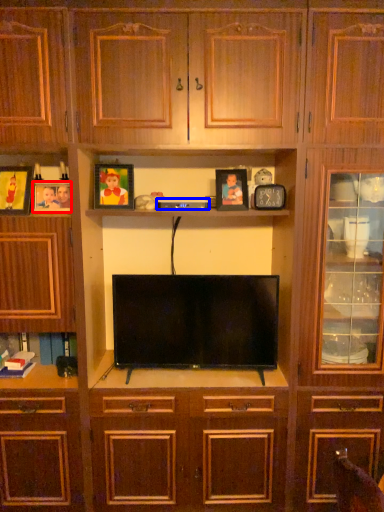
Question: Among these objects, which one is nearest to the camera, picture frame (highlighted by a red box) or appliance (highlighted by a blue box)?

Choices:
 (A) picture frame
 (B) appliance

Answer: (A)